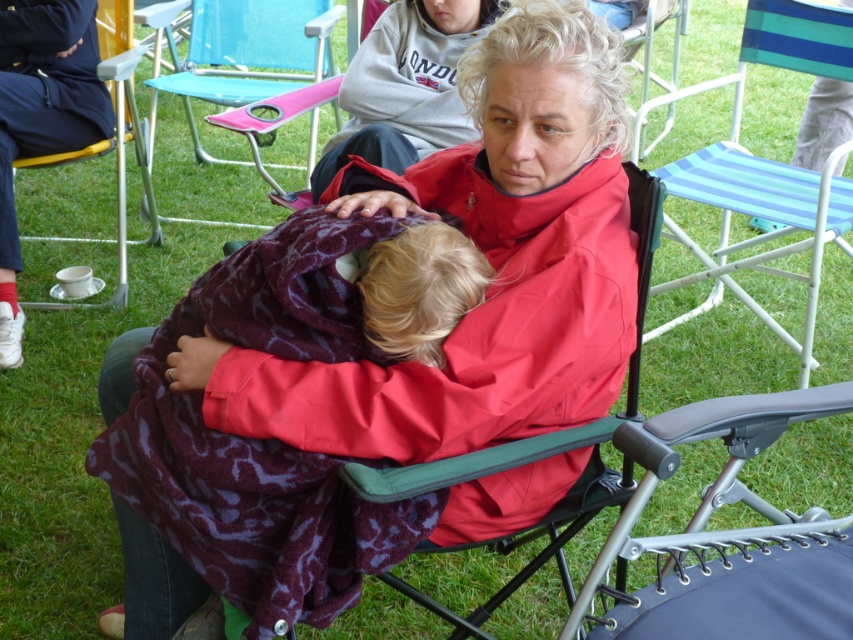
Question: Is pink fabric chair at center below metallic silver cup at lower left?

Choices:
 (A) yes
 (B) no

Answer: (B)

Question: Which object is positioned farthest from the matte red jacket at center?

Choices:
 (A) blue striped fabric chair at center right
 (B) blonde hair at center
 (C) red fabric chair at center
 (D) metallic silver cup at lower left

Answer: (D)

Question: Among these objects, which one is nearest to the camera?

Choices:
 (A) matte red jacket at center
 (B) pink fabric chair at center

Answer: (A)

Question: Does matte red jacket at center have a larger size compared to pink fabric chair at center?

Choices:
 (A) no
 (B) yes

Answer: (A)

Question: Based on their relative distances, which object is nearer to the matte red jacket at center?

Choices:
 (A) blonde hair at center
 (B) metallic silver cup at lower left
 (C) blue striped fabric chair at center right

Answer: (A)

Question: In this image, where is blue striped fabric chair at center right located relative to pink fabric chair at center?

Choices:
 (A) right
 (B) left

Answer: (A)